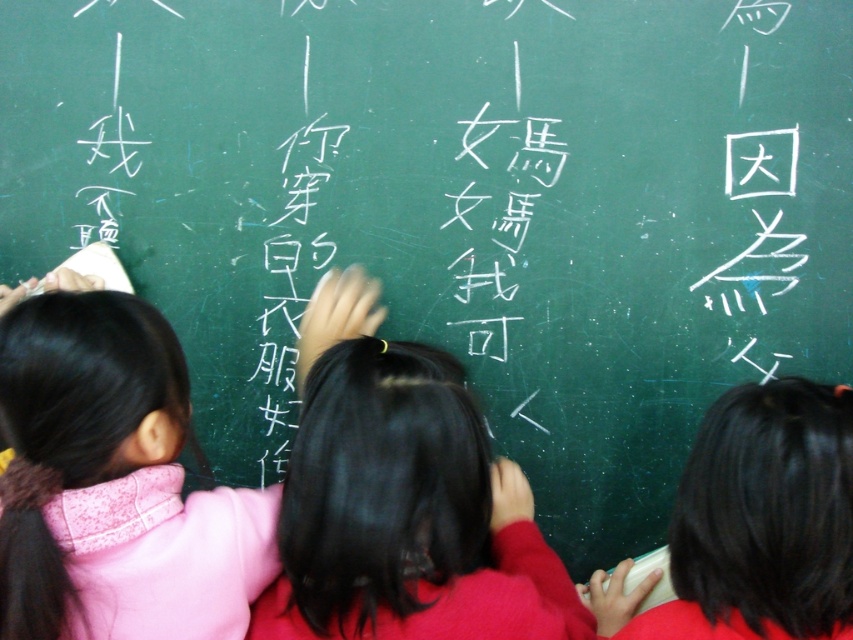
Question: Does pink fabric at left appear under black hair at right?

Choices:
 (A) yes
 (B) no

Answer: (B)

Question: Which object appears closest to the camera in this image?

Choices:
 (A) black hair at right
 (B) pink fabric at left

Answer: (A)

Question: Does pink fabric at left come in front of black hair at right?

Choices:
 (A) yes
 (B) no

Answer: (B)

Question: Can you confirm if pink fabric at left is positioned above black hair at right?

Choices:
 (A) yes
 (B) no

Answer: (A)